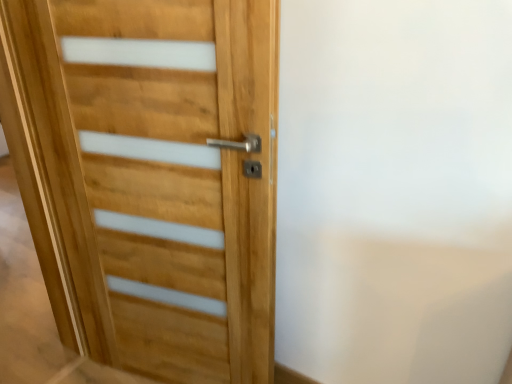
Question: Should I look upward or downward to see natural wood door at center?

Choices:
 (A) down
 (B) up

Answer: (A)